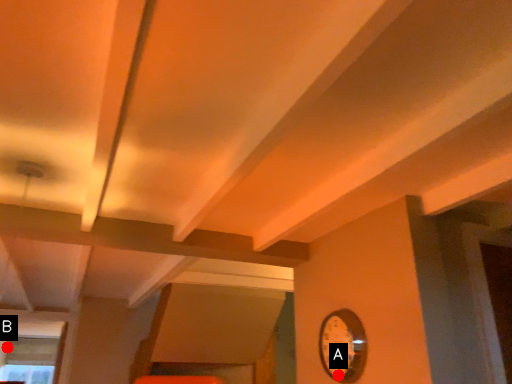
Question: Two points are circled on the image, labeled by A and B beside each circle. Which point is closer to the camera?

Choices:
 (A) A is closer
 (B) B is closer

Answer: (A)